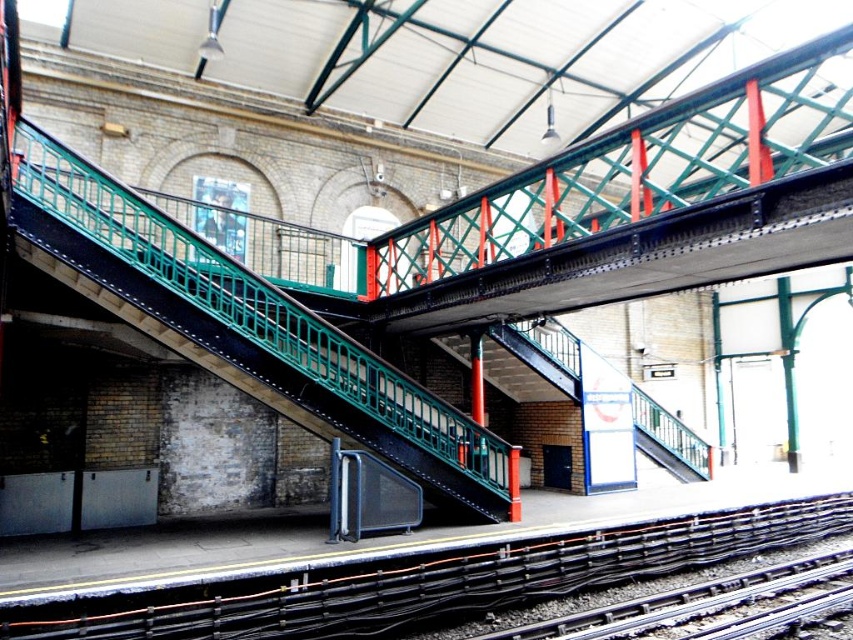
Does black metal train track at lower left appear on the left side of smooth steel tracks at bottom right?

Correct, you'll find black metal train track at lower left to the left of smooth steel tracks at bottom right.

Which is more to the left, black metal train track at lower left or smooth steel tracks at bottom right?

Positioned to the left is black metal train track at lower left.

Where is `black metal train track at lower left`? black metal train track at lower left is located at coordinates (428, 580).

At what (x,y) coordinates should I click in order to perform the action: click on black metal train track at lower left. Please return your answer as a coordinate pair (x, y). Looking at the image, I should click on (428, 580).

Is green metal staircase at center taller than smooth steel tracks at bottom right?

Yes, green metal staircase at center is taller than smooth steel tracks at bottom right.

Measure the distance from green metal staircase at center to smooth steel tracks at bottom right.

They are 3.34 meters apart.

Which is behind, point (305, 380) or point (660, 600)?

The point (305, 380) is more distant.

This screenshot has height=640, width=853. I want to click on green metal staircase at center, so click(x=258, y=355).

Who is more forward, (x=579, y=568) or (x=294, y=330)?

Point (x=579, y=568)

This screenshot has width=853, height=640. What do you see at coordinates (428, 580) in the screenshot?
I see `black metal train track at lower left` at bounding box center [428, 580].

What are the coordinates of `black metal train track at lower left` in the screenshot? It's located at (428, 580).